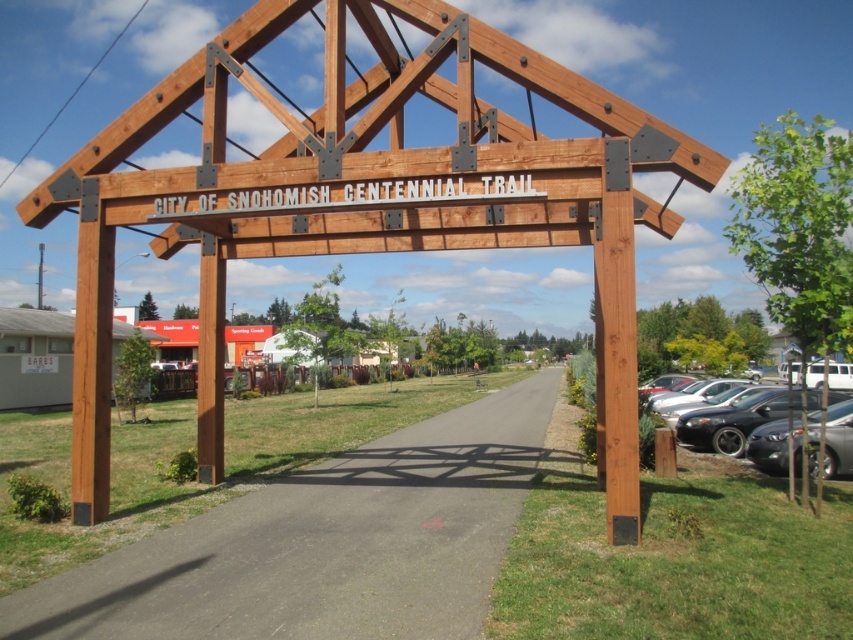
Question: From the image, what is the correct spatial relationship of shiny black sedan at right in relation to matte black car at lower right?

Choices:
 (A) above
 (B) below

Answer: (A)

Question: Estimate the real-world distances between objects in this image. Which object is farther from the asphalt path at center?

Choices:
 (A) natural wood sign at center
 (B) shiny black sedan at right
 (C) matte black car at lower right

Answer: (B)

Question: Can you confirm if asphalt path at center is positioned to the left of matte black car at lower right?

Choices:
 (A) yes
 (B) no

Answer: (A)

Question: Is the position of natural wood sign at center more distant than that of asphalt path at center?

Choices:
 (A) yes
 (B) no

Answer: (A)

Question: Which point is closer to the camera taking this photo?

Choices:
 (A) (462, 611)
 (B) (764, 442)
 (C) (590, 90)
 (D) (706, 449)

Answer: (A)

Question: Which object appears farthest from the camera in this image?

Choices:
 (A) shiny black sedan at right
 (B) natural wood sign at center
 (C) asphalt path at center
 (D) matte black car at lower right

Answer: (A)